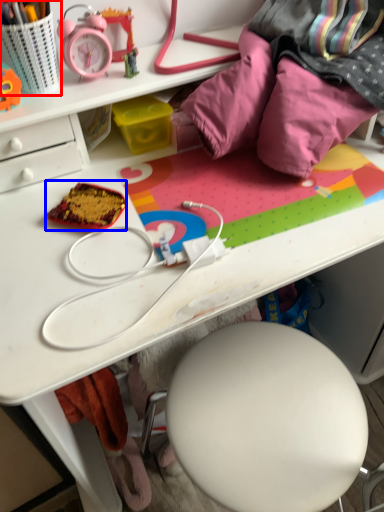
Question: Which point is closer to the camera, stationery (highlighted by a red box) or stuff (highlighted by a blue box)?

Choices:
 (A) stationery
 (B) stuff

Answer: (A)